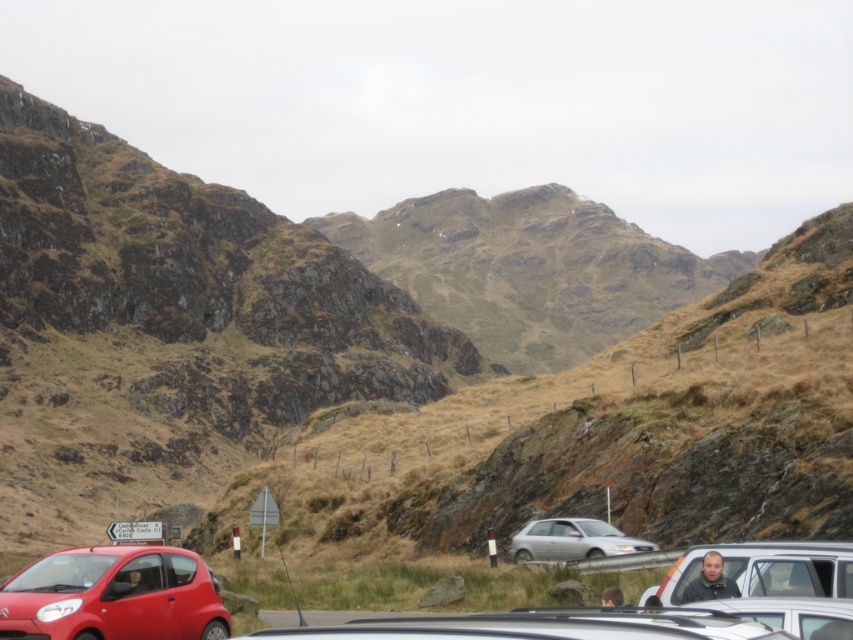
Question: Is matte silver van at lower right wider than satin silver sedan at center?

Choices:
 (A) no
 (B) yes

Answer: (B)

Question: Which point is closer to the camera?

Choices:
 (A) matte silver van at lower right
 (B) dark gray shirt at lower right

Answer: (A)

Question: Which point appears closest to the camera in this image?

Choices:
 (A) (137, 568)
 (B) (558, 547)
 (C) (767, 561)
 (D) (700, 598)

Answer: (C)

Question: Which point appears farthest from the camera in this image?

Choices:
 (A) (698, 582)
 (B) (107, 572)
 (C) (738, 563)

Answer: (B)

Question: Does matte silver van at lower right have a larger size compared to dark gray shirt at lower right?

Choices:
 (A) no
 (B) yes

Answer: (B)

Question: Where is shiny red car at lower left located in relation to satin silver sedan at center in the image?

Choices:
 (A) right
 (B) left

Answer: (B)